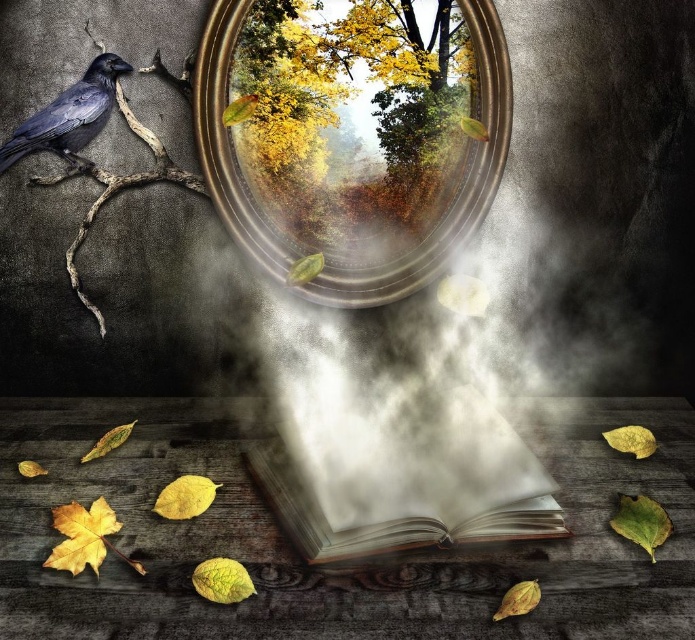
Identify the location of metallic reflective mirror at center. The height and width of the screenshot is (640, 695). (457, 195).

Which of these two, metallic reflective mirror at center or shiny black crow at upper left, stands taller?

With more height is metallic reflective mirror at center.

Where is `metallic reflective mirror at center`? Image resolution: width=695 pixels, height=640 pixels. metallic reflective mirror at center is located at coordinates (457, 195).

Can you confirm if metallic reflective mirror at center is bigger than wooden pages book at center?

Yes, metallic reflective mirror at center is bigger than wooden pages book at center.

Is metallic reflective mirror at center taller than wooden pages book at center?

Yes.

Where is `metallic reflective mirror at center`? metallic reflective mirror at center is located at coordinates (457, 195).

Does yellow leafy tree at upper center have a lesser height compared to metallic reflective mirror at center?

Yes.

Is yellow leafy tree at upper center positioned at the back of metallic reflective mirror at center?

Yes, yellow leafy tree at upper center is further from the viewer.

This screenshot has width=695, height=640. In order to click on yellow leafy tree at upper center in this screenshot , I will do `click(345, 77)`.